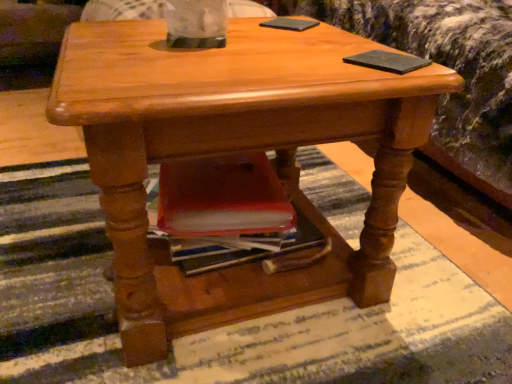
How much space does black matte pad at upper right, positioned as the second pad in back-to-front order, occupy vertically?

0.43 inches.

You are a GUI agent. You are given a task and a screenshot of the screen. Output one action in this format:
    pyautogui.click(x=<x>, y=<y>)
    Task: Click on the black matte pad at upper right, which appears as the first pad when viewed from the front
    
    Given the screenshot: What is the action you would take?
    pyautogui.click(x=388, y=61)

Describe the element at coordinates (388, 61) in the screenshot. This screenshot has width=512, height=384. I see `black matte pad at upper right, which is the first pad from bottom to top` at that location.

In order to face black matte pad at upper right, positioned as the second pad in top-to-bottom order, should I rotate leftwards or rightwards?

It's best to rotate right around 17.354 degrees.

What do you see at coordinates (290, 24) in the screenshot?
I see `green matte pad at upper center, which ranks as the 1th pad in top-to-bottom order` at bounding box center [290, 24].

This screenshot has height=384, width=512. Find the location of `green matte pad at upper center, the second pad positioned from the right`. green matte pad at upper center, the second pad positioned from the right is located at coordinates (290, 24).

In order to face green matte pad at upper center, the second pad positioned from the right, should I rotate leftwards or rightwards?

To face it directly, rotate right by 4.653 degrees.

Where is `black matte pad at upper right, placed as the second pad when sorted from left to right`? black matte pad at upper right, placed as the second pad when sorted from left to right is located at coordinates (388, 61).

Is black matte pad at upper right, placed as the second pad when sorted from left to right, to the left of green matte pad at upper center, which ranks as the 1th pad in top-to-bottom order, from the viewer's perspective?

Incorrect, black matte pad at upper right, placed as the second pad when sorted from left to right, is not on the left side of green matte pad at upper center, which ranks as the 1th pad in top-to-bottom order.

Is the position of black matte pad at upper right, positioned as the 1th pad in right-to-left order, more distant than that of green matte pad at upper center, the second pad positioned from the right?

No, it is not.

Which is closer to the camera, (401, 57) or (285, 19)?

Point (401, 57) is positioned closer to the camera compared to point (285, 19).

From the image's perspective, which one is positioned higher, black matte pad at upper right, positioned as the second pad in top-to-bottom order, or green matte pad at upper center, acting as the second pad starting from the bottom?

green matte pad at upper center, acting as the second pad starting from the bottom, appears higher in the image.

From a real-world perspective, which object stands above the other?

green matte pad at upper center, the second pad positioned from the right.

Can you confirm if black matte pad at upper right, positioned as the second pad in top-to-bottom order, is wider than green matte pad at upper center, the 2th pad from the front?

Incorrect, the width of black matte pad at upper right, positioned as the second pad in top-to-bottom order, does not surpass that of green matte pad at upper center, the 2th pad from the front.

Can you confirm if black matte pad at upper right, positioned as the second pad in back-to-front order, is taller than green matte pad at upper center, acting as the second pad starting from the bottom?

Incorrect, the height of black matte pad at upper right, positioned as the second pad in back-to-front order, is not larger of that of green matte pad at upper center, acting as the second pad starting from the bottom.

Can you confirm if black matte pad at upper right, positioned as the 1th pad in right-to-left order, is bigger than green matte pad at upper center, the 1th pad from the back?

No, black matte pad at upper right, positioned as the 1th pad in right-to-left order, is not bigger than green matte pad at upper center, the 1th pad from the back.

Is black matte pad at upper right, positioned as the 1th pad in right-to-left order, inside the boundaries of green matte pad at upper center, the second pad positioned from the right, or outside?

black matte pad at upper right, positioned as the 1th pad in right-to-left order, is outside green matte pad at upper center, the second pad positioned from the right.

Is black matte pad at upper right, positioned as the second pad in back-to-front order, beside green matte pad at upper center, the second pad positioned from the right?

No, black matte pad at upper right, positioned as the second pad in back-to-front order, is not touching green matte pad at upper center, the second pad positioned from the right.

Is black matte pad at upper right, positioned as the second pad in back-to-front order, looking in the opposite direction of green matte pad at upper center, the 1th pad from the back?

Yes, black matte pad at upper right, positioned as the second pad in back-to-front order,'s orientation is away from green matte pad at upper center, the 1th pad from the back.

Find the location of a particular element. The image size is (512, 384). pad above the black matte pad at upper right, positioned as the 1th pad in right-to-left order (from a real-world perspective) is located at coordinates (290, 24).

Is green matte pad at upper center, the 2th pad from the front, at the left side of black matte pad at upper right, positioned as the second pad in top-to-bottom order?

Indeed, green matte pad at upper center, the 2th pad from the front, is positioned on the left side of black matte pad at upper right, positioned as the second pad in top-to-bottom order.

Relative to black matte pad at upper right, placed as the second pad when sorted from left to right, is green matte pad at upper center, acting as the second pad starting from the bottom, in front or behind?

Visually, green matte pad at upper center, acting as the second pad starting from the bottom, is located behind black matte pad at upper right, placed as the second pad when sorted from left to right.

Does point (296, 22) come behind point (347, 63)?

Yes, point (296, 22) is behind point (347, 63).

From the image's perspective, is green matte pad at upper center, acting as the second pad starting from the bottom, located above or below black matte pad at upper right, positioned as the 1th pad in right-to-left order?

Based on their image positions, green matte pad at upper center, acting as the second pad starting from the bottom, is located above black matte pad at upper right, positioned as the 1th pad in right-to-left order.

From a real-world perspective, who is located lower, green matte pad at upper center, the 1th pad from the back, or black matte pad at upper right, which appears as the first pad when viewed from the front?

In real-world perspective, black matte pad at upper right, which appears as the first pad when viewed from the front, is lower.

Which object is thinner, green matte pad at upper center, the 1th pad from the back, or black matte pad at upper right, positioned as the 1th pad in right-to-left order?

With smaller width is black matte pad at upper right, positioned as the 1th pad in right-to-left order.

Considering the relative sizes of green matte pad at upper center, the second pad positioned from the right, and black matte pad at upper right, positioned as the second pad in top-to-bottom order, in the image provided, is green matte pad at upper center, the second pad positioned from the right, shorter than black matte pad at upper right, positioned as the second pad in top-to-bottom order,?

No, green matte pad at upper center, the second pad positioned from the right, is not shorter than black matte pad at upper right, positioned as the second pad in top-to-bottom order.

Considering the sizes of objects green matte pad at upper center, the 2th pad from the front, and black matte pad at upper right, which is the first pad from bottom to top, in the image provided, who is bigger, green matte pad at upper center, the 2th pad from the front, or black matte pad at upper right, which is the first pad from bottom to top,?

Bigger between the two is green matte pad at upper center, the 2th pad from the front.

Do you think green matte pad at upper center, acting as the second pad starting from the bottom, is within black matte pad at upper right, positioned as the 1th pad in right-to-left order, or outside of it?

green matte pad at upper center, acting as the second pad starting from the bottom, exists outside the volume of black matte pad at upper right, positioned as the 1th pad in right-to-left order.

Is green matte pad at upper center, the second pad positioned from the right, not close to black matte pad at upper right, positioned as the 1th pad in right-to-left order?

No, there isn't a large distance between green matte pad at upper center, the second pad positioned from the right, and black matte pad at upper right, positioned as the 1th pad in right-to-left order.

Is green matte pad at upper center, acting as the second pad starting from the bottom, turned away from black matte pad at upper right, placed as the second pad when sorted from left to right?

green matte pad at upper center, acting as the second pad starting from the bottom, is not turned away from black matte pad at upper right, placed as the second pad when sorted from left to right.

How different are the orientations of green matte pad at upper center, the 1th pad from the back, and black matte pad at upper right, positioned as the 1th pad in right-to-left order, in degrees?

74.3 degrees.

Image resolution: width=512 pixels, height=384 pixels. Identify the location of pad above the black matte pad at upper right, which appears as the first pad when viewed from the front (from the image's perspective). pos(290,24).

Locate an element on the screen. The width and height of the screenshot is (512, 384). pad in front of the green matte pad at upper center, acting as the second pad starting from the bottom is located at coordinates (388, 61).

This screenshot has height=384, width=512. I want to click on pad below the green matte pad at upper center, the 1th pad from the back (from a real-world perspective), so click(388, 61).